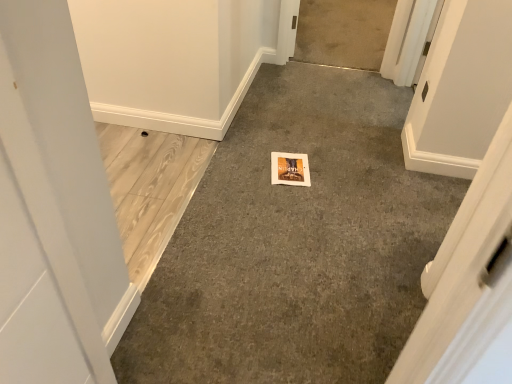
The image size is (512, 384). What do you see at coordinates (150, 188) in the screenshot?
I see `light brown wood flooring at left, which is the 2th concrete in back-to-front order` at bounding box center [150, 188].

Identify the location of light brown wood flooring at left, the 2th concrete viewed from the front. (150, 188).

Which is more to the left, gray carpet at center, marked as the first concrete in a front-to-back arrangement, or light brown wood flooring at left, which is the 2th concrete in back-to-front order?

From the viewer's perspective, light brown wood flooring at left, which is the 2th concrete in back-to-front order, appears more on the left side.

Considering the points (387, 98) and (189, 185), which point is behind, point (387, 98) or point (189, 185)?

The point (387, 98) is farther.

In the image, is gray carpet at center, marked as the first concrete in a front-to-back arrangement, positioned in front of or behind light brown wood flooring at left, which is the 2th concrete in back-to-front order?

Clearly, gray carpet at center, marked as the first concrete in a front-to-back arrangement, is in front of light brown wood flooring at left, which is the 2th concrete in back-to-front order.

The width and height of the screenshot is (512, 384). I want to click on concrete that is the 1st object directly below the gray carpet at center, which is counted as the third concrete, starting from the back (from a real-world perspective), so click(150, 188).

Considering the relative sizes of gray carpet at center, which is counted as the 1th concrete, starting from the back, and light brown wood flooring at left, which is the 2th concrete in back-to-front order, in the image provided, is gray carpet at center, which is counted as the 1th concrete, starting from the back, shorter than light brown wood flooring at left, which is the 2th concrete in back-to-front order,?

Incorrect, the height of gray carpet at center, which is counted as the 1th concrete, starting from the back, does not fall short of that of light brown wood flooring at left, which is the 2th concrete in back-to-front order.

Between point (347, 26) and point (182, 140), which one is positioned behind?

The point (347, 26) is behind.

Is gray carpet at center, which is counted as the 1th concrete, starting from the back, far from light brown wood flooring at left, which is the 2th concrete in back-to-front order?

Yes.

You are a GUI agent. You are given a task and a screenshot of the screen. Output one action in this format:
    pyautogui.click(x=<x>, y=<y>)
    Task: Click on the 2nd concrete counting from the right of the light brown wood flooring at left, the 2th concrete viewed from the front
    
    Given the screenshot: What is the action you would take?
    pyautogui.click(x=343, y=32)

Is point (175, 202) closer or farther from the camera than point (379, 227)?

Clearly, point (175, 202) is more distant from the camera than point (379, 227).

From the image's perspective, would you say light brown wood flooring at left, the 2th concrete viewed from the front, is positioned over gray carpet at center, marked as the first concrete in a front-to-back arrangement?

Actually, light brown wood flooring at left, the 2th concrete viewed from the front, appears below gray carpet at center, marked as the first concrete in a front-to-back arrangement, in the image.

Starting from the light brown wood flooring at left, the 2th concrete viewed from the front, which concrete is the 1st one to the right? Please provide its 2D coordinates.

[(296, 244)]

From a real-world perspective, is light brown wood flooring at left, which is the 2th concrete in back-to-front order, positioned over gray carpet at center, marked as the first concrete in a front-to-back arrangement, based on gravity?

No, from a real-world perspective, light brown wood flooring at left, which is the 2th concrete in back-to-front order, is not above gray carpet at center, marked as the first concrete in a front-to-back arrangement.

Is light brown wood flooring at left, the 2th concrete viewed from the front, aimed at gray carpet at center, which is counted as the 1th concrete, starting from the back?

A: No, light brown wood flooring at left, the 2th concrete viewed from the front, is not turned towards gray carpet at center, which is counted as the 1th concrete, starting from the back.

What's the angular difference between light brown wood flooring at left, which is the 2th concrete in back-to-front order, and gray carpet at center, the third concrete positioned from the front,'s facing directions?

There is a 87.3-degree angle between the facing directions of light brown wood flooring at left, which is the 2th concrete in back-to-front order, and gray carpet at center, the third concrete positioned from the front.

Considering the sizes of objects light brown wood flooring at left, which is the 2th concrete in back-to-front order, and gray carpet at center, which is counted as the 1th concrete, starting from the back, in the image provided, who is thinner, light brown wood flooring at left, which is the 2th concrete in back-to-front order, or gray carpet at center, which is counted as the 1th concrete, starting from the back,?

light brown wood flooring at left, which is the 2th concrete in back-to-front order.

Does gray carpet at center, which is counted as the 1th concrete, starting from the back, lie in front of gray carpet at center, marked as the first concrete in a front-to-back arrangement?

No, it is not.

At what (x,y) coordinates should I click in order to perform the action: click on the 1st concrete below when counting from the gray carpet at center, the third concrete positioned from the front (from the image's perspective). Please return your answer as a coordinate pair (x, y). Looking at the image, I should click on coord(296,244).

Looking at this image, from a real-world perspective, between gray carpet at center, which is counted as the 1th concrete, starting from the back, and gray carpet at center, which is counted as the third concrete, starting from the back, who is vertically higher?

gray carpet at center, which is counted as the third concrete, starting from the back.

Is gray carpet at center, which is counted as the 1th concrete, starting from the back, aimed at gray carpet at center, which is counted as the third concrete, starting from the back?

Yes, gray carpet at center, which is counted as the 1th concrete, starting from the back, is turned towards gray carpet at center, which is counted as the third concrete, starting from the back.

Which concrete is the 1st one when counting from the left side of the gray carpet at center, the third concrete positioned from the front? Please provide its 2D coordinates.

[(296, 244)]

From a real-world perspective, is gray carpet at center, which is counted as the third concrete, starting from the back, physically located above or below gray carpet at center, the third concrete positioned from the front?

gray carpet at center, which is counted as the third concrete, starting from the back, is above gray carpet at center, the third concrete positioned from the front.

Is gray carpet at center, which is counted as the third concrete, starting from the back, outside of gray carpet at center, which is counted as the 1th concrete, starting from the back?

Yes, gray carpet at center, which is counted as the third concrete, starting from the back, is not within gray carpet at center, which is counted as the 1th concrete, starting from the back.

Between gray carpet at center, which is counted as the third concrete, starting from the back, and gray carpet at center, the third concrete positioned from the front, which one has larger size?

Bigger between the two is gray carpet at center, which is counted as the third concrete, starting from the back.

Find the location of a particular element. concrete in front of the light brown wood flooring at left, which is the 2th concrete in back-to-front order is located at coordinates (296, 244).

I want to click on concrete behind the light brown wood flooring at left, which is the 2th concrete in back-to-front order, so click(343, 32).

Estimate the real-world distances between objects in this image. Which object is further from gray carpet at center, which is counted as the 1th concrete, starting from the back, gray carpet at center, marked as the first concrete in a front-to-back arrangement, or light brown wood flooring at left, the 2th concrete viewed from the front?

Based on the image, light brown wood flooring at left, the 2th concrete viewed from the front, appears to be further to gray carpet at center, which is counted as the 1th concrete, starting from the back.

From the image, which object appears to be farther from light brown wood flooring at left, which is the 2th concrete in back-to-front order, gray carpet at center, which is counted as the third concrete, starting from the back, or gray carpet at center, the third concrete positioned from the front?

The object further to light brown wood flooring at left, which is the 2th concrete in back-to-front order, is gray carpet at center, the third concrete positioned from the front.

Estimate the real-world distances between objects in this image. Which object is further from light brown wood flooring at left, which is the 2th concrete in back-to-front order, gray carpet at center, which is counted as the 1th concrete, starting from the back, or gray carpet at center, marked as the first concrete in a front-to-back arrangement?

The object further to light brown wood flooring at left, which is the 2th concrete in back-to-front order, is gray carpet at center, which is counted as the 1th concrete, starting from the back.

Based on their spatial positions, is gray carpet at center, which is counted as the 1th concrete, starting from the back, or light brown wood flooring at left, the 2th concrete viewed from the front, further from gray carpet at center, marked as the first concrete in a front-to-back arrangement?

gray carpet at center, which is counted as the 1th concrete, starting from the back, lies further to gray carpet at center, marked as the first concrete in a front-to-back arrangement, than the other object.

Consider the image. Considering their positions, is light brown wood flooring at left, which is the 2th concrete in back-to-front order, positioned further to gray carpet at center, the third concrete positioned from the front, than gray carpet at center, which is counted as the third concrete, starting from the back?

Based on the image, light brown wood flooring at left, which is the 2th concrete in back-to-front order, appears to be further to gray carpet at center, the third concrete positioned from the front.

Looking at the image, which one is located further to gray carpet at center, marked as the first concrete in a front-to-back arrangement, light brown wood flooring at left, the 2th concrete viewed from the front, or gray carpet at center, which is counted as the 1th concrete, starting from the back?

gray carpet at center, which is counted as the 1th concrete, starting from the back.

Image resolution: width=512 pixels, height=384 pixels. In order to click on concrete between gray carpet at center, which is counted as the third concrete, starting from the back, and gray carpet at center, which is counted as the 1th concrete, starting from the back, along the z-axis in this screenshot , I will do `click(150, 188)`.